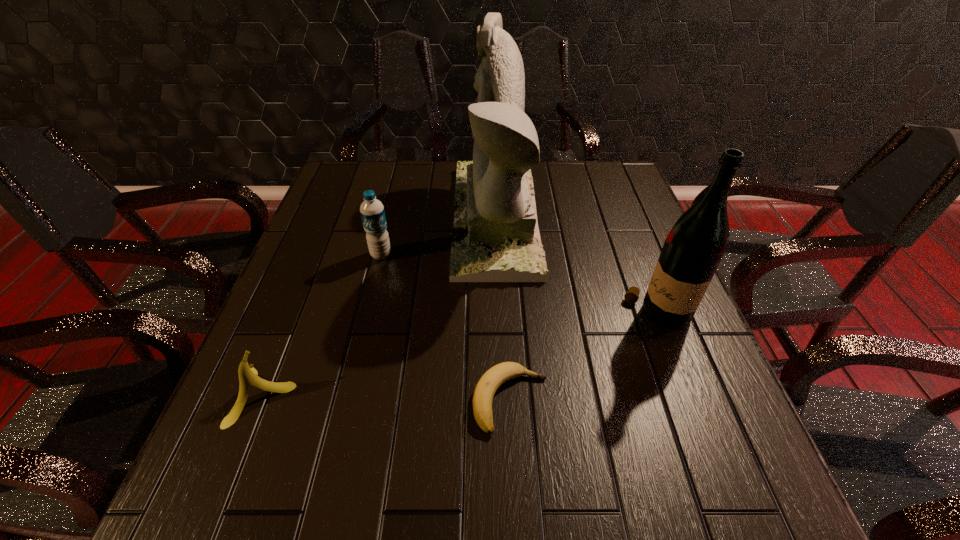
You are a GUI agent. You are given a task and a screenshot of the screen. Output one action in this format:
    pyautogui.click(x=<x>, y=<y>)
    Task: Click on the unoccupied position between the sculpture and the taller banana
    The width and height of the screenshot is (960, 540).
    Given the screenshot: What is the action you would take?
    click(x=380, y=307)

Where is `blank region between the sculpture and the shorter banana`? The image size is (960, 540). blank region between the sculpture and the shorter banana is located at coordinates tap(503, 309).

At what (x,y) coordinates should I click in order to perform the action: click on empty space that is in between the sculpture and the second tallest object. Please return your answer as a coordinate pair (x, y). Looking at the image, I should click on (576, 267).

Where is `free area in between the fourth tallest object and the sculpture`? The width and height of the screenshot is (960, 540). free area in between the fourth tallest object and the sculpture is located at coordinates (380, 307).

You are a GUI agent. You are given a task and a screenshot of the screen. Output one action in this format:
    pyautogui.click(x=<x>, y=<y>)
    Task: Click on the free space between the leftmost object and the third farthest object
    Image resolution: width=960 pixels, height=540 pixels.
    Given the screenshot: What is the action you would take?
    460,355

I want to click on vacant space in between the sculpture and the shortest object, so click(x=503, y=309).

Locate an element on the screen. This screenshot has height=540, width=960. free spot between the second tallest object and the sculpture is located at coordinates (576, 267).

Where is `vacant space in between the shortest object and the fourth shortest object`? vacant space in between the shortest object and the fourth shortest object is located at coordinates (584, 358).

This screenshot has height=540, width=960. I want to click on the second closest object to the second object from left to right, so click(247, 374).

Select which object appears as the closest to the second object from left to right. Please provide its 2D coordinates. Your answer should be formatted as a tuple, i.e. [(x, y)], where the tuple contains the x and y coordinates of a point satisfying the conditions above.

[(495, 238)]